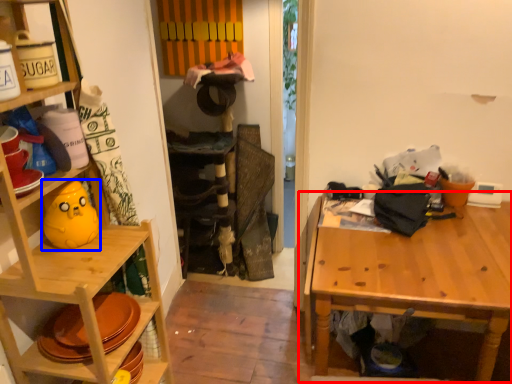
Question: Among these objects, which one is nearest to the camera, table (highlighted by a red box) or toy (highlighted by a blue box)?

Choices:
 (A) table
 (B) toy

Answer: (B)